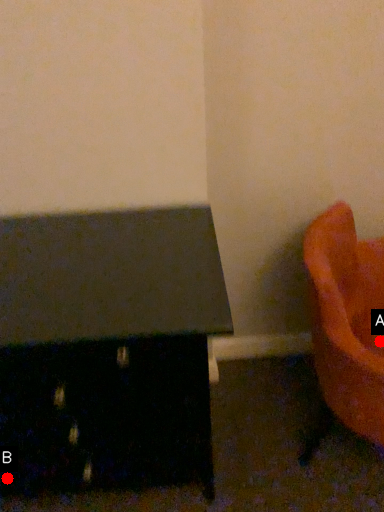
Question: Two points are circled on the image, labeled by A and B beside each circle. Among these points, which one is nearest to the camera?

Choices:
 (A) A is closer
 (B) B is closer

Answer: (A)